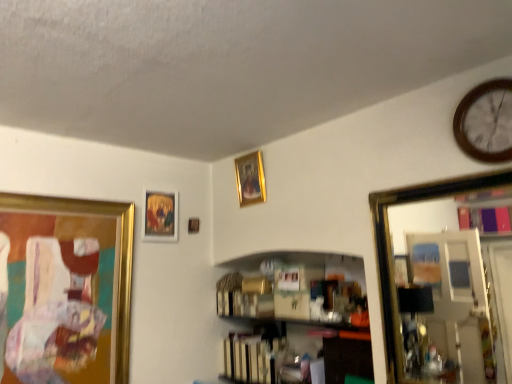
Question: Considering the relative positions of wooden picture frame at upper center, marked as the third picture frame in a left-to-right arrangement, and gold-framed mirror at right in the image provided, is wooden picture frame at upper center, marked as the third picture frame in a left-to-right arrangement, to the right of gold-framed mirror at right from the viewer's perspective?

Choices:
 (A) yes
 (B) no

Answer: (B)

Question: From the image's perspective, is wooden picture frame at upper center, marked as the third picture frame in a left-to-right arrangement, located above gold-framed mirror at right?

Choices:
 (A) no
 (B) yes

Answer: (B)

Question: Does wooden picture frame at upper center, which is the second picture frame in right-to-left order, have a lesser width compared to gold-framed mirror at right?

Choices:
 (A) yes
 (B) no

Answer: (A)

Question: Is wooden picture frame at upper center, marked as the third picture frame in a left-to-right arrangement, at the left side of gold-framed mirror at right?

Choices:
 (A) no
 (B) yes

Answer: (B)

Question: Is the position of wooden picture frame at upper center, which is the second picture frame in right-to-left order, more distant than that of gold-framed mirror at right?

Choices:
 (A) yes
 (B) no

Answer: (A)

Question: Relative to gold-framed painting at upper center, positioned as the 3th picture frame in right-to-left order, is gold-framed mirror at right in front or behind?

Choices:
 (A) front
 (B) behind

Answer: (A)

Question: Is gold-framed mirror at right situated inside gold-framed painting at upper center, positioned as the 3th picture frame in right-to-left order, or outside?

Choices:
 (A) outside
 (B) inside

Answer: (A)

Question: From a real-world perspective, is gold-framed mirror at right physically located above or below gold-framed painting at upper center, positioned as the 3th picture frame in right-to-left order?

Choices:
 (A) below
 (B) above

Answer: (A)

Question: Is gold-framed mirror at right wider or thinner than gold-framed painting at upper center, positioned as the 3th picture frame in right-to-left order?

Choices:
 (A) wide
 (B) thin

Answer: (A)

Question: Is gold-framed mirror at right taller or shorter than gold metallic picture frame at left, the 1th picture frame from the left?

Choices:
 (A) short
 (B) tall

Answer: (A)

Question: Looking at the image, does gold-framed mirror at right seem bigger or smaller compared to gold metallic picture frame at left, the 4th picture frame when ordered from right to left?

Choices:
 (A) small
 (B) big

Answer: (A)

Question: Choose the correct answer: Is gold-framed mirror at right inside gold metallic picture frame at left, the 1th picture frame from the left, or outside it?

Choices:
 (A) outside
 (B) inside

Answer: (A)

Question: Is point (382, 281) positioned closer to the camera than point (75, 379)?

Choices:
 (A) closer
 (B) farther

Answer: (A)

Question: Is gold metallic picture frame at left, the 4th picture frame when ordered from right to left, taller or shorter than gold-framed mirror at right?

Choices:
 (A) tall
 (B) short

Answer: (A)

Question: Based on their positions, is gold metallic picture frame at left, the 4th picture frame when ordered from right to left, located to the left or right of gold-framed mirror at right?

Choices:
 (A) left
 (B) right

Answer: (A)